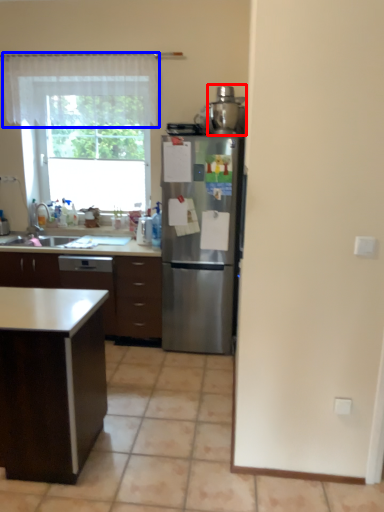
Question: Which of the following is the closest to the observer, appliance (highlighted by a red box) or curtain (highlighted by a blue box)?

Choices:
 (A) appliance
 (B) curtain

Answer: (A)